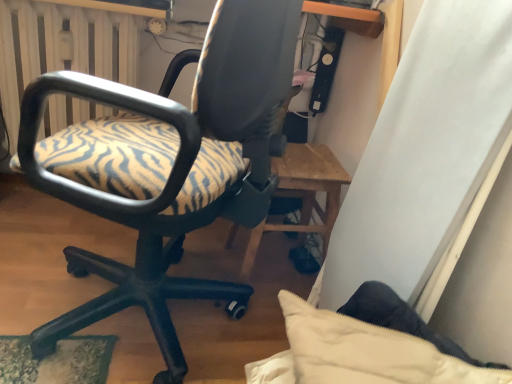
Question: From a real-world perspective, is white radiator at upper left positioned above or below zebra-patterned fabric office chair at left?

Choices:
 (A) below
 (B) above

Answer: (A)

Question: From the image's perspective, is white radiator at upper left located above or below zebra-patterned fabric office chair at left?

Choices:
 (A) below
 (B) above

Answer: (B)

Question: Considering their positions, is white radiator at upper left located in front of or behind zebra-patterned fabric office chair at left?

Choices:
 (A) behind
 (B) front

Answer: (A)

Question: Does point (209, 125) appear closer or farther from the camera than point (55, 48)?

Choices:
 (A) closer
 (B) farther

Answer: (A)

Question: Would you say zebra-patterned fabric office chair at left is to the left or to the right of white radiator at upper left in the picture?

Choices:
 (A) left
 (B) right

Answer: (B)

Question: In the image, is zebra-patterned fabric office chair at left positioned in front of or behind white radiator at upper left?

Choices:
 (A) behind
 (B) front

Answer: (B)

Question: Is zebra-patterned fabric office chair at left wider or thinner than white radiator at upper left?

Choices:
 (A) wide
 (B) thin

Answer: (A)